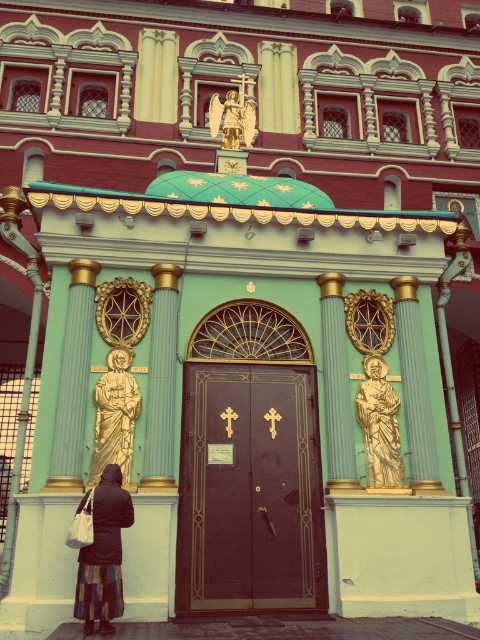
Question: In this image, where is dark brown wooden door at center located relative to gold polished statue at right?

Choices:
 (A) left
 (B) right

Answer: (A)

Question: Which point appears farthest from the camera in this image?

Choices:
 (A) (388, 420)
 (B) (229, 100)

Answer: (B)

Question: Does dark brown wooden door at center come in front of gold polished statue at right?

Choices:
 (A) no
 (B) yes

Answer: (B)

Question: Which of the following is the closest to the observer?

Choices:
 (A) gold polished statue at right
 (B) gold polished statue at center
 (C) gold/gilded statue at center
 (D) dark brown wooden door at center

Answer: (D)

Question: Can you confirm if dark brown wooden door at center is smaller than gold polished statue at right?

Choices:
 (A) no
 (B) yes

Answer: (A)

Question: Based on their relative distances, which object is farther from the gold polished statue at right?

Choices:
 (A) dark brown leather coat at lower center
 (B) gold polished statue at center

Answer: (A)